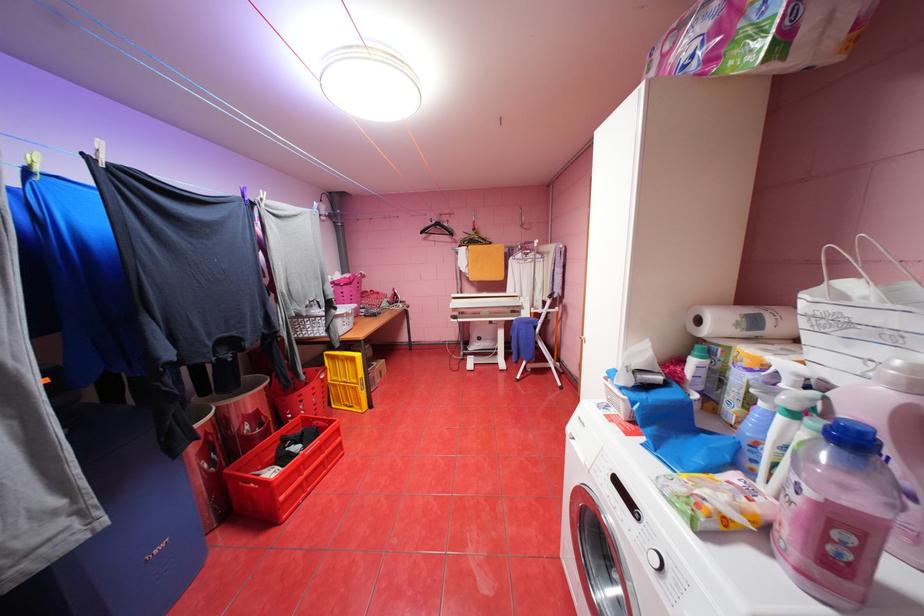
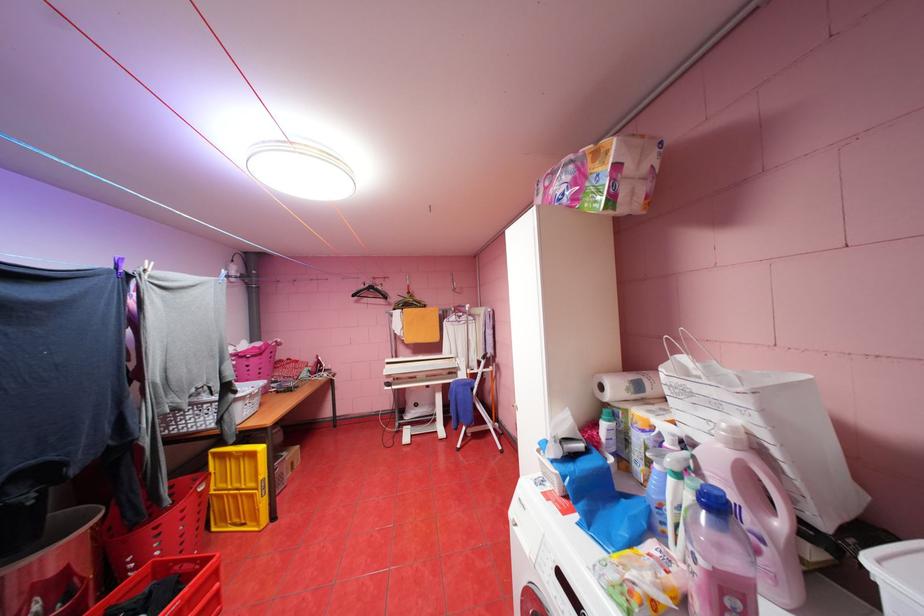
Where in the second image is the point corresponding to (x=336, y=355) from the first image?

(224, 454)